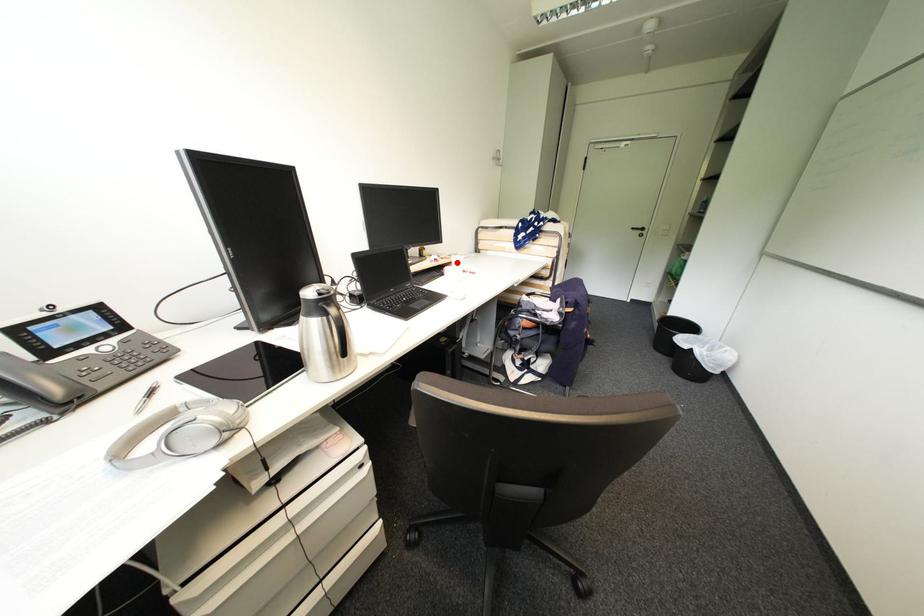
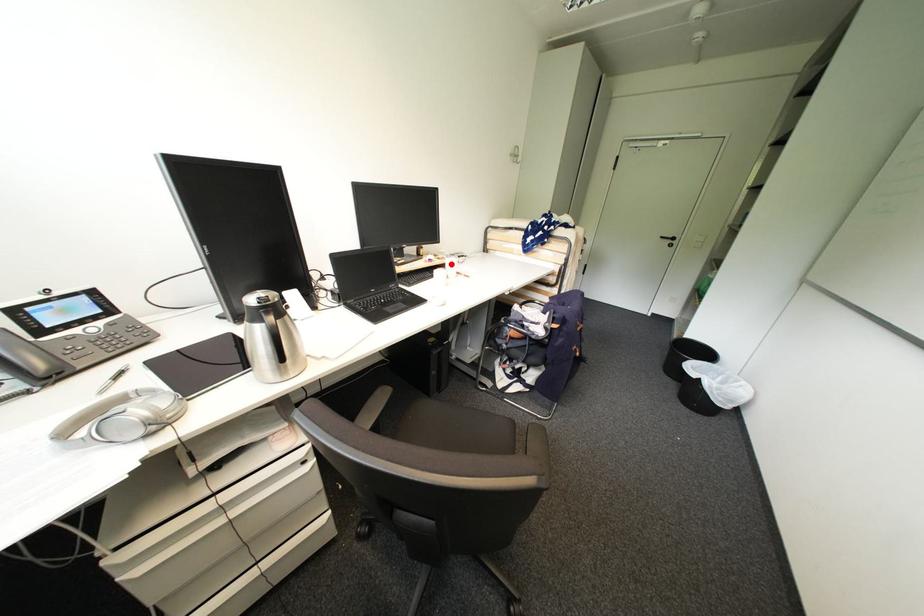
I am providing you with two images of the same scene from different viewpoints. A red point is marked on the first image and another point is marked on the second image. Are the points marked in image1 and image2 representing the same 3D position?

Yes